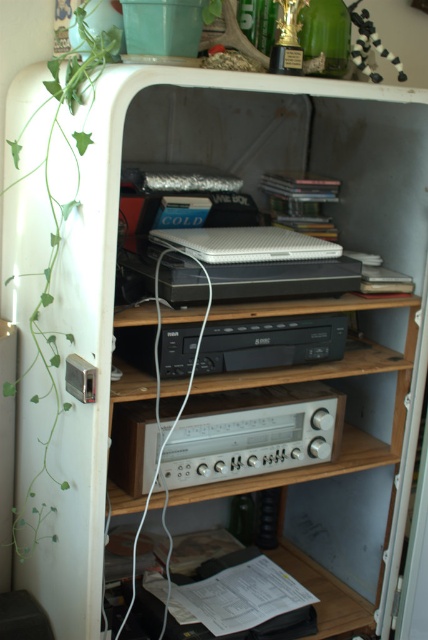
Question: Among these objects, which one is farthest from the camera?

Choices:
 (A) black plastic stereo at center
 (B) silver metallic stereo at center
 (C) green leafy plant at left

Answer: (B)

Question: Is silver metallic stereo at center to the right of black plastic stereo at center from the viewer's perspective?

Choices:
 (A) yes
 (B) no

Answer: (B)

Question: Based on their relative distances, which object is farther from the silver metallic stereo at center?

Choices:
 (A) black plastic stereo at center
 (B) green leafy plant at left

Answer: (B)

Question: Based on their relative distances, which object is farther from the black plastic stereo at center?

Choices:
 (A) silver metallic stereo at center
 (B) green leafy plant at left

Answer: (B)

Question: Can you confirm if silver metallic stereo at center is positioned to the right of black plastic stereo at center?

Choices:
 (A) yes
 (B) no

Answer: (B)

Question: Does silver metallic stereo at center appear over black plastic stereo at center?

Choices:
 (A) yes
 (B) no

Answer: (B)